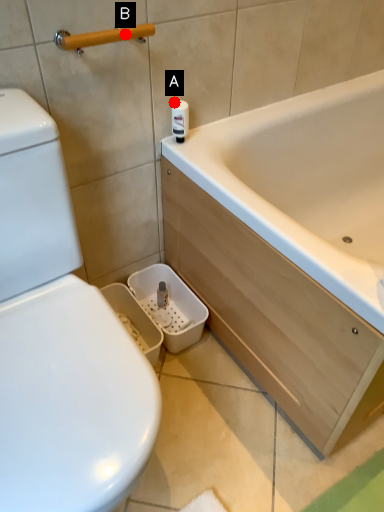
Question: Two points are circled on the image, labeled by A and B beside each circle. Among these points, which one is farthest from the camera?

Choices:
 (A) A is further
 (B) B is further

Answer: (A)